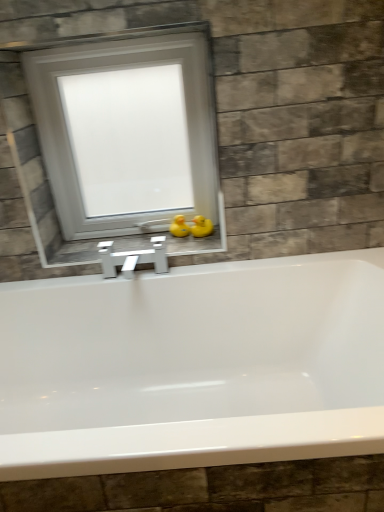
Question: From a real-world perspective, is white frosted glass window at upper center on top of white glossy window sill at center?

Choices:
 (A) no
 (B) yes

Answer: (B)

Question: Does white frosted glass window at upper center appear on the right side of white glossy window sill at center?

Choices:
 (A) no
 (B) yes

Answer: (A)

Question: Is white frosted glass window at upper center behind white glossy window sill at center?

Choices:
 (A) no
 (B) yes

Answer: (A)

Question: Does white frosted glass window at upper center have a lesser width compared to white glossy window sill at center?

Choices:
 (A) yes
 (B) no

Answer: (A)

Question: Does white frosted glass window at upper center have a greater width compared to white glossy window sill at center?

Choices:
 (A) no
 (B) yes

Answer: (A)

Question: Is white frosted glass window at upper center directly adjacent to white glossy window sill at center?

Choices:
 (A) no
 (B) yes

Answer: (A)

Question: Would you say yellow rubber duck at center, the first duck when ordered from right to left, is part of white frosted glass window at upper center's contents?

Choices:
 (A) no
 (B) yes

Answer: (A)

Question: Could you tell me if white frosted glass window at upper center is turned towards yellow rubber duck at center, the second duck from the left?

Choices:
 (A) no
 (B) yes

Answer: (B)

Question: Is white frosted glass window at upper center at the right side of yellow rubber duck at center, the first duck when ordered from right to left?

Choices:
 (A) no
 (B) yes

Answer: (A)

Question: Is the position of white frosted glass window at upper center more distant than that of yellow rubber duck at center, the second duck from the left?

Choices:
 (A) yes
 (B) no

Answer: (B)

Question: From the image's perspective, is white frosted glass window at upper center under yellow rubber duck at center, the first duck when ordered from right to left?

Choices:
 (A) no
 (B) yes

Answer: (A)

Question: From a real-world perspective, is white frosted glass window at upper center over yellow rubber duck at center, the first duck when ordered from right to left?

Choices:
 (A) yes
 (B) no

Answer: (A)

Question: From a real-world perspective, does yellow rubber duck at center, the second duck from the left, stand above white frosted glass window at upper center?

Choices:
 (A) yes
 (B) no

Answer: (B)